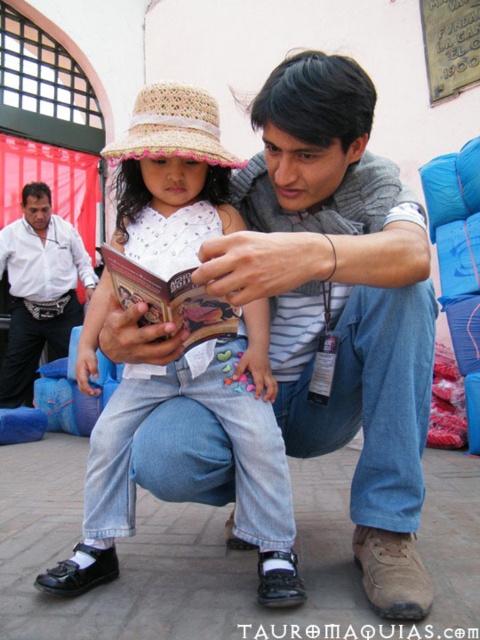
You are a photographer trying to capture a candid shot of the scene. You want to ensure that both the white shirt at left and the hardcover book at center are clearly visible in your photo. Based on their positions, which object should you prioritize framing first to ensure both are in the shot?

You should prioritize framing the white shirt at left first because it is positioned to the left of the hardcover book at center. By centering the white shirt at left in your viewfinder, you can then adjust to include the hardcover book at center while maintaining both in the frame.

In the scene shown: You are standing in a public space and see a point at coordinate (x=192, y=92). You want to take a photo of this point with a camera that has a minimum focus distance of 6 feet. Will the camera be able to focus on the point?

The point at coordinate (x=192, y=92) is 5.94 feet away from the camera, which is less than the minimum focus distance of 6 feet. Therefore, the camera may not be able to focus on the point.